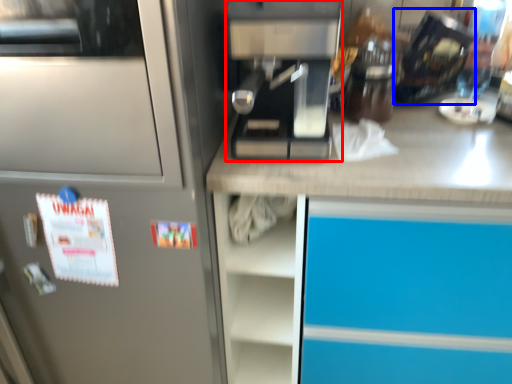
Question: Which object is closer to the camera taking this photo, kitchen appliance (highlighted by a red box) or appliance (highlighted by a blue box)?

Choices:
 (A) kitchen appliance
 (B) appliance

Answer: (A)